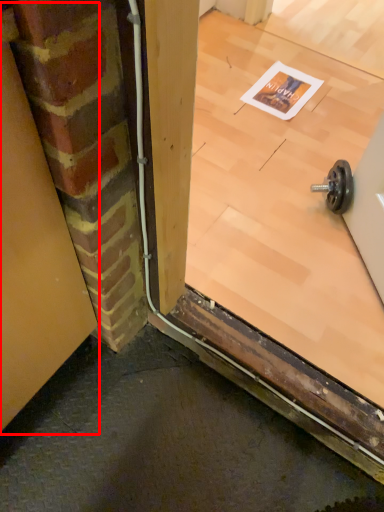
Question: From the image's perspective, where is garage door (annotated by the red box) located in relation to window in the image?

Choices:
 (A) above
 (B) below

Answer: (B)